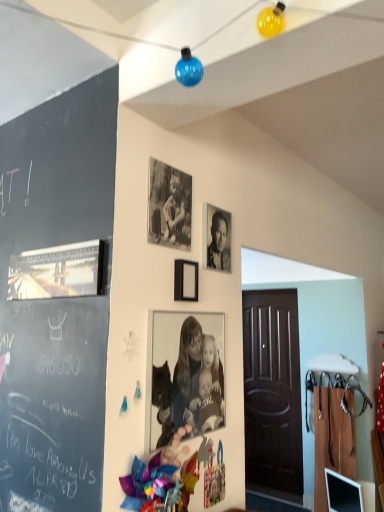
Question: From a real-world perspective, is black matte photo frame at center, which is counted as the 2th picture frame, starting from the left, below matte black picture frame at upper center, which is the first picture frame from right to left?

Choices:
 (A) no
 (B) yes

Answer: (A)

Question: Considering the relative sizes of black matte photo frame at center, which is counted as the 2th picture frame, starting from the left, and matte black picture frame at upper center, arranged as the third picture frame when viewed from the left, in the image provided, is black matte photo frame at center, which is counted as the 2th picture frame, starting from the left, smaller than matte black picture frame at upper center, arranged as the third picture frame when viewed from the left,?

Choices:
 (A) no
 (B) yes

Answer: (A)

Question: From the image's perspective, does black matte photo frame at center, which is counted as the 2th picture frame, starting from the left, appear lower than matte black picture frame at upper center, arranged as the third picture frame when viewed from the left?

Choices:
 (A) yes
 (B) no

Answer: (B)

Question: From a real-world perspective, is black matte photo frame at center, which is counted as the 2th picture frame, starting from the left, located higher than matte black picture frame at upper center, arranged as the third picture frame when viewed from the left?

Choices:
 (A) yes
 (B) no

Answer: (A)

Question: From the image's perspective, is black matte photo frame at center, which is counted as the 2th picture frame, starting from the left, on top of matte black picture frame at upper center, which is the first picture frame from right to left?

Choices:
 (A) no
 (B) yes

Answer: (B)

Question: Is point (180, 290) positioned closer to the camera than point (192, 431)?

Choices:
 (A) farther
 (B) closer

Answer: (A)

Question: Based on their positions, is matte black picture frame at upper center, arranged as the third picture frame when viewed from the left, located to the left or right of black and white photograph of people at center, which ranks as the 2th person in top-to-bottom order?

Choices:
 (A) left
 (B) right

Answer: (A)

Question: From the image's perspective, is matte black picture frame at upper center, which is the first picture frame from right to left, positioned above or below black and white photograph of people at center, which is the 1th person in bottom-to-top order?

Choices:
 (A) above
 (B) below

Answer: (A)

Question: From a real-world perspective, is matte black picture frame at upper center, arranged as the third picture frame when viewed from the left, physically located above or below black and white photograph of people at center, which is the 1th person in bottom-to-top order?

Choices:
 (A) above
 (B) below

Answer: (A)

Question: From a real-world perspective, is black and white photograph of people at center, which ranks as the 2th person in top-to-bottom order, physically located above or below black and white photograph at upper center, the second person ordered from the bottom?

Choices:
 (A) above
 (B) below

Answer: (B)

Question: Is black and white photograph of people at center, which ranks as the 2th person in top-to-bottom order, taller or shorter than black and white photograph at upper center, positioned as the first person in top-to-bottom order?

Choices:
 (A) short
 (B) tall

Answer: (B)

Question: From the image's perspective, relative to black and white photograph at upper center, the second person ordered from the bottom, is black and white photograph of people at center, which is the 1th person in bottom-to-top order, above or below?

Choices:
 (A) above
 (B) below

Answer: (B)

Question: Is black and white photograph of people at center, which ranks as the 2th person in top-to-bottom order, inside or outside of black and white photograph at upper center, the second person ordered from the bottom?

Choices:
 (A) inside
 (B) outside

Answer: (B)

Question: Choose the correct answer: Is black and white photograph of people at center, which is the 1th person in bottom-to-top order, inside black matte photo frame at center, the second picture frame positioned from the right, or outside it?

Choices:
 (A) inside
 (B) outside

Answer: (B)

Question: From the image's perspective, is black and white photograph of people at center, which is the 1th person in bottom-to-top order, above or below black matte photo frame at center, the second picture frame positioned from the right?

Choices:
 (A) below
 (B) above

Answer: (A)